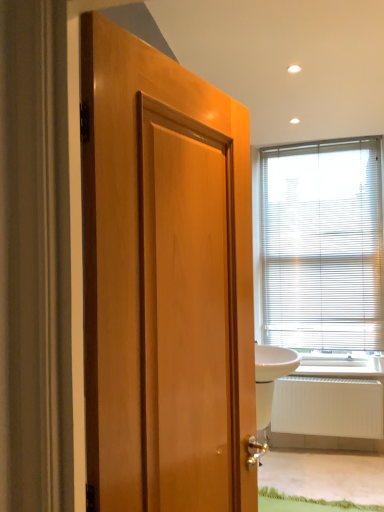
Question: Is wooden door at center facing towards white glossy sink at right?

Choices:
 (A) no
 (B) yes

Answer: (B)

Question: Is wooden door at center not within white glossy sink at right?

Choices:
 (A) yes
 (B) no

Answer: (A)

Question: Does wooden door at center have a lesser height compared to white glossy sink at right?

Choices:
 (A) yes
 (B) no

Answer: (B)

Question: Considering the relative sizes of wooden door at center and white glossy sink at right in the image provided, is wooden door at center taller than white glossy sink at right?

Choices:
 (A) yes
 (B) no

Answer: (A)

Question: Is wooden door at center bigger than white glossy sink at right?

Choices:
 (A) no
 (B) yes

Answer: (A)

Question: Considering the relative sizes of wooden door at center and white glossy sink at right in the image provided, is wooden door at center wider than white glossy sink at right?

Choices:
 (A) yes
 (B) no

Answer: (B)

Question: Does white glossy sink at right have a larger size compared to wooden door at center?

Choices:
 (A) no
 (B) yes

Answer: (B)

Question: From the image's perspective, is white glossy sink at right below wooden door at center?

Choices:
 (A) no
 (B) yes

Answer: (B)

Question: From the image's perspective, is white glossy sink at right over wooden door at center?

Choices:
 (A) yes
 (B) no

Answer: (B)

Question: Is white glossy sink at right to the right of wooden door at center from the viewer's perspective?

Choices:
 (A) yes
 (B) no

Answer: (A)

Question: Is white glossy sink at right completely or partially outside of wooden door at center?

Choices:
 (A) yes
 (B) no

Answer: (A)

Question: Can wooden door at center be found inside white glossy sink at right?

Choices:
 (A) yes
 (B) no

Answer: (B)

Question: From a real-world perspective, is white plastic blinds at upper right under wooden door at center?

Choices:
 (A) yes
 (B) no

Answer: (B)